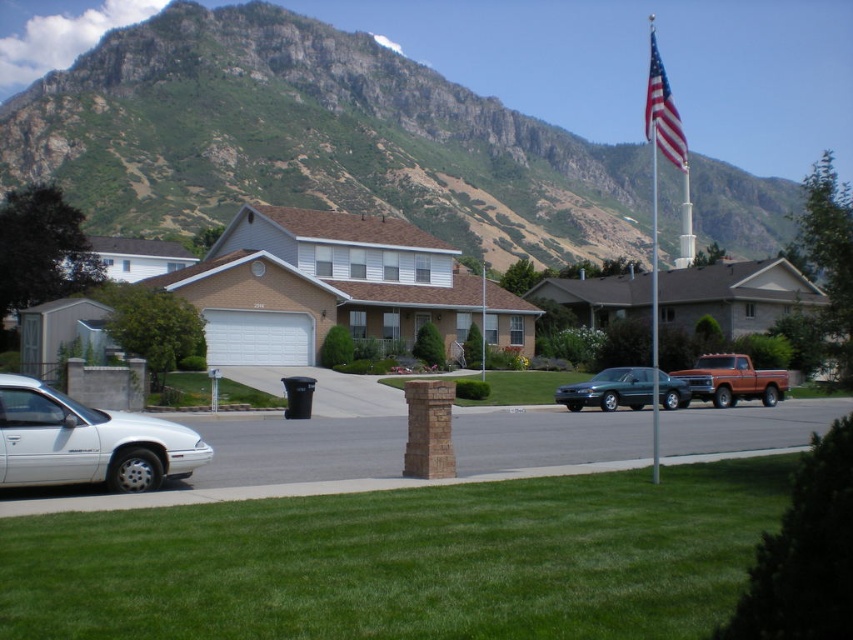
You are standing at the point with coordinates point (485, 330) and want to walk to the point with coordinates point (653, 122). Which direction should you move to reach your destination?

You should move forward because point (653, 122) is in front of point (485, 330).

You are standing at the center of the lawn in the suburban neighborhood scene. You want to locate the metallic flagpole at center. Which direction should you look to find it?

The metallic flagpole at center is located at coordinates point (x=654, y=308), so you should look to the right side of the frame to find it.